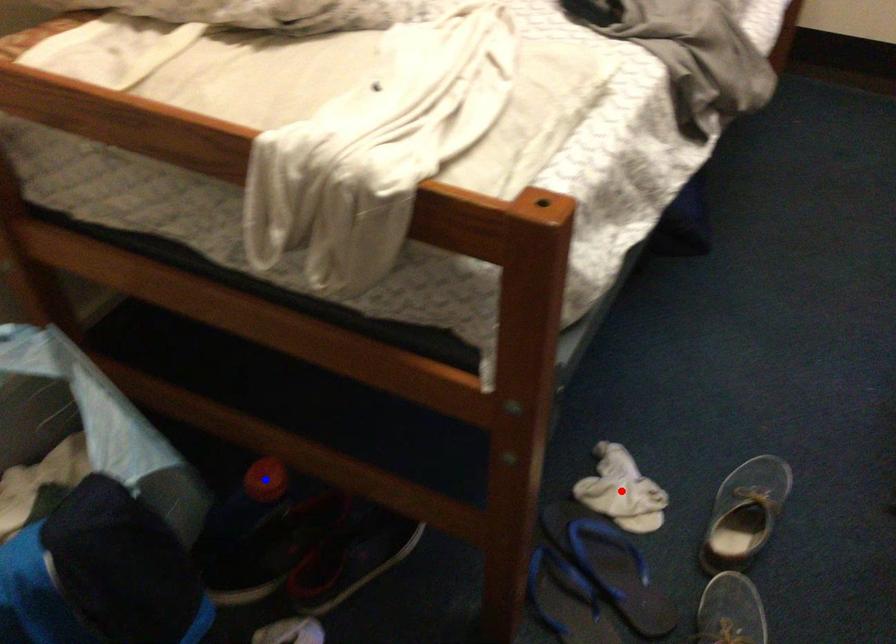
Question: Which of the two points in the image is closer to the camera?

Choices:
 (A) Blue point is closer.
 (B) Red point is closer.

Answer: (A)